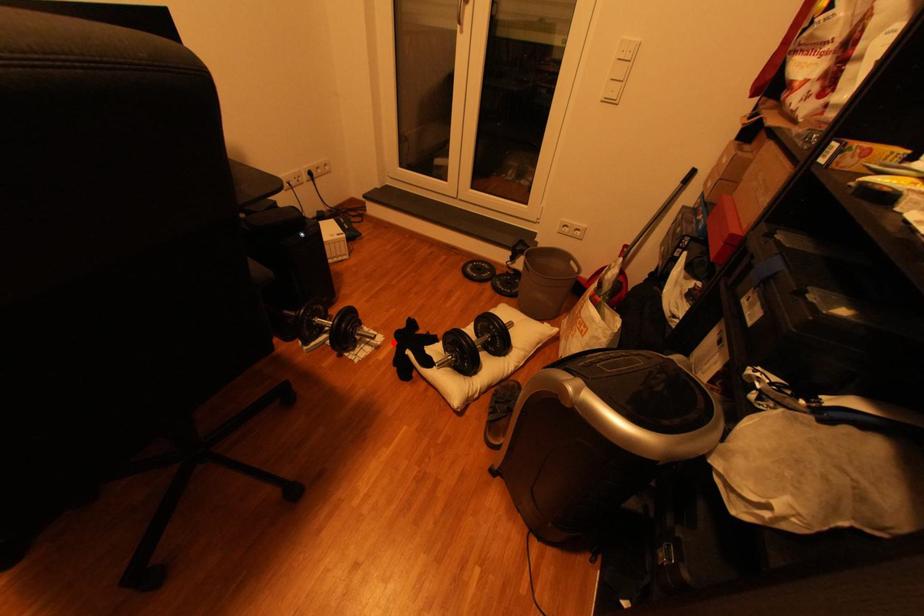
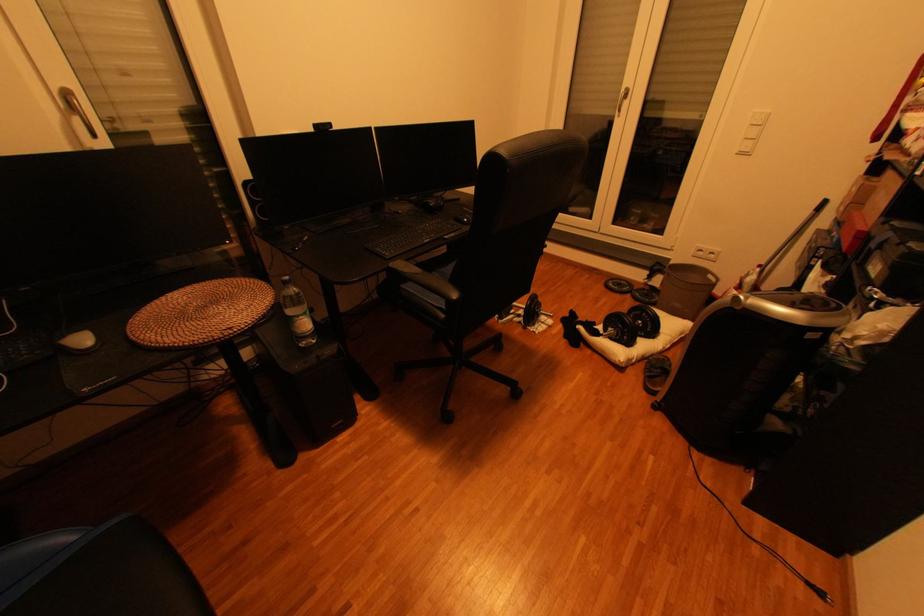
Question: I am providing you with two images of the same scene from different viewpoints. A red point is marked on the first image. Can you still see the location of the red point in image 2?

Choices:
 (A) Yes
 (B) No

Answer: (A)